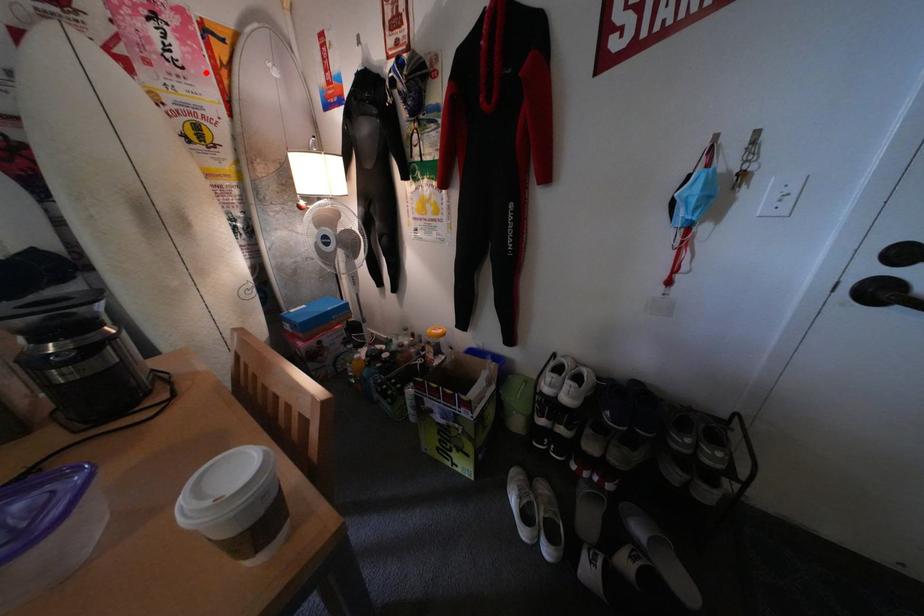
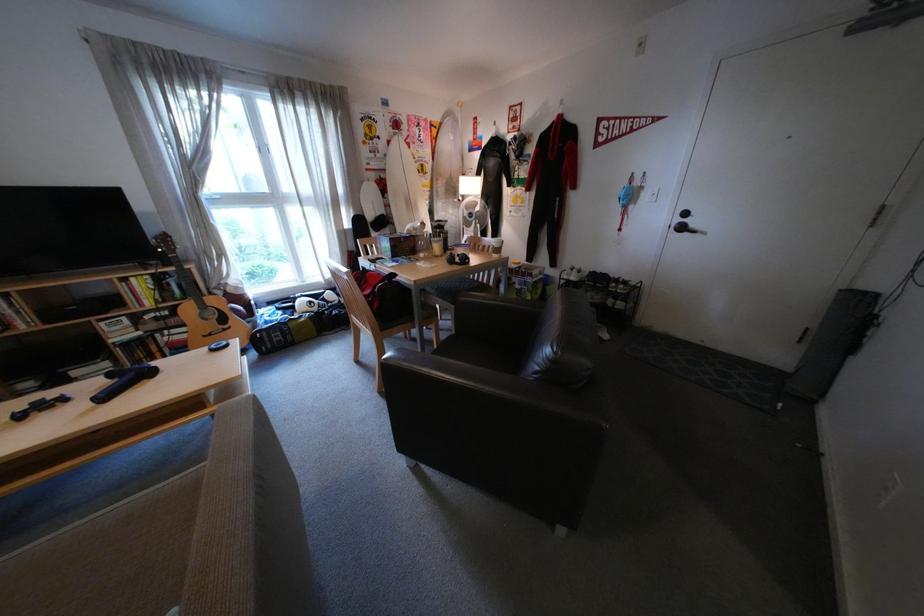
Find the pixel in the second image that matches the highlighted location in the first image.

(439, 145)